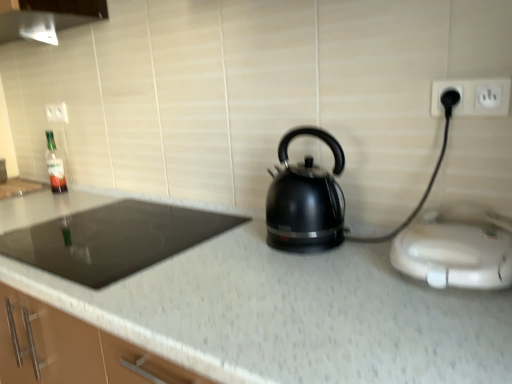
Question: From a real-world perspective, is white granite countertop at center over black glass cooktop at left?

Choices:
 (A) no
 (B) yes

Answer: (A)

Question: Is black glass cooktop at left surrounded by white granite countertop at center?

Choices:
 (A) no
 (B) yes

Answer: (B)

Question: Can you confirm if white granite countertop at center is bigger than black glass cooktop at left?

Choices:
 (A) no
 (B) yes

Answer: (B)

Question: From a real-world perspective, is white granite countertop at center beneath black glass cooktop at left?

Choices:
 (A) no
 (B) yes

Answer: (B)

Question: Is white granite countertop at center looking in the opposite direction of black glass cooktop at left?

Choices:
 (A) yes
 (B) no

Answer: (A)

Question: From their relative heights in the image, would you say white plastic electric outlet at upper center, the first electric outlet from the back, is taller or shorter than white plastic toaster at right?

Choices:
 (A) tall
 (B) short

Answer: (B)

Question: Is white plastic electric outlet at upper center, the 2th electric outlet viewed from the right, inside the boundaries of white plastic toaster at right, or outside?

Choices:
 (A) outside
 (B) inside

Answer: (A)

Question: From a real-world perspective, is white plastic electric outlet at upper center, which is the first electric outlet in top-to-bottom order, physically located above or below white plastic toaster at right?

Choices:
 (A) above
 (B) below

Answer: (A)

Question: Visually, is white plastic electric outlet at upper center, the 2th electric outlet viewed from the right, positioned to the left or to the right of white plastic toaster at right?

Choices:
 (A) right
 (B) left

Answer: (B)

Question: From a real-world perspective, is black plastic electric outlet at upper right, which is the 2th electric outlet in left-to-right order, above or below translucent glass bottle at left?

Choices:
 (A) above
 (B) below

Answer: (A)

Question: Does point (437, 82) appear closer or farther from the camera than point (53, 187)?

Choices:
 (A) farther
 (B) closer

Answer: (B)

Question: From their relative heights in the image, would you say black plastic electric outlet at upper right, which is the 2th electric outlet in left-to-right order, is taller or shorter than translucent glass bottle at left?

Choices:
 (A) short
 (B) tall

Answer: (A)

Question: Looking at the image, does black plastic electric outlet at upper right, which appears as the 2th electric outlet when viewed from the top, seem bigger or smaller compared to translucent glass bottle at left?

Choices:
 (A) big
 (B) small

Answer: (B)

Question: In terms of width, does white plastic toaster at right look wider or thinner when compared to white plastic electric outlet at upper center, which is the second electric outlet in bottom-to-top order?

Choices:
 (A) thin
 (B) wide

Answer: (B)

Question: Based on their sizes in the image, would you say white plastic toaster at right is bigger or smaller than white plastic electric outlet at upper center, which is the second electric outlet in bottom-to-top order?

Choices:
 (A) big
 (B) small

Answer: (A)